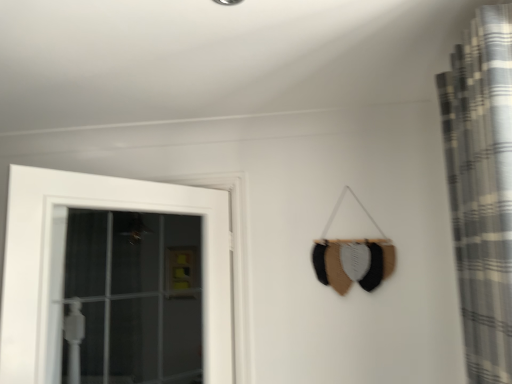
Question: Should I look upward or downward to see white wooden door at left?

Choices:
 (A) down
 (B) up

Answer: (A)

Question: Is plaid fabric curtain at right turned away from white wooden door at left?

Choices:
 (A) no
 (B) yes

Answer: (A)

Question: Could white wooden door at left be considered to be inside plaid fabric curtain at right?

Choices:
 (A) yes
 (B) no

Answer: (B)

Question: Is plaid fabric curtain at right not within white wooden door at left?

Choices:
 (A) yes
 (B) no

Answer: (A)

Question: Is plaid fabric curtain at right bigger than white wooden door at left?

Choices:
 (A) no
 (B) yes

Answer: (B)

Question: Would you consider plaid fabric curtain at right to be distant from white wooden door at left?

Choices:
 (A) no
 (B) yes

Answer: (B)

Question: Does plaid fabric curtain at right have a lesser width compared to white wooden door at left?

Choices:
 (A) no
 (B) yes

Answer: (A)

Question: Considering the relative sizes of white wooden door at left and plaid fabric curtain at right in the image provided, is white wooden door at left wider than plaid fabric curtain at right?

Choices:
 (A) yes
 (B) no

Answer: (B)

Question: Considering the relative positions of white wooden door at left and plaid fabric curtain at right in the image provided, is white wooden door at left behind plaid fabric curtain at right?

Choices:
 (A) yes
 (B) no

Answer: (A)

Question: Is white wooden door at left bigger than plaid fabric curtain at right?

Choices:
 (A) yes
 (B) no

Answer: (B)

Question: From the image's perspective, would you say white wooden door at left is positioned over plaid fabric curtain at right?

Choices:
 (A) no
 (B) yes

Answer: (A)

Question: Does white wooden door at left lie in front of plaid fabric curtain at right?

Choices:
 (A) yes
 (B) no

Answer: (B)

Question: Does white wooden door at left have a lesser width compared to plaid fabric curtain at right?

Choices:
 (A) no
 (B) yes

Answer: (B)

Question: Which is correct: white wooden door at left is inside plaid fabric curtain at right, or outside of it?

Choices:
 (A) outside
 (B) inside

Answer: (A)